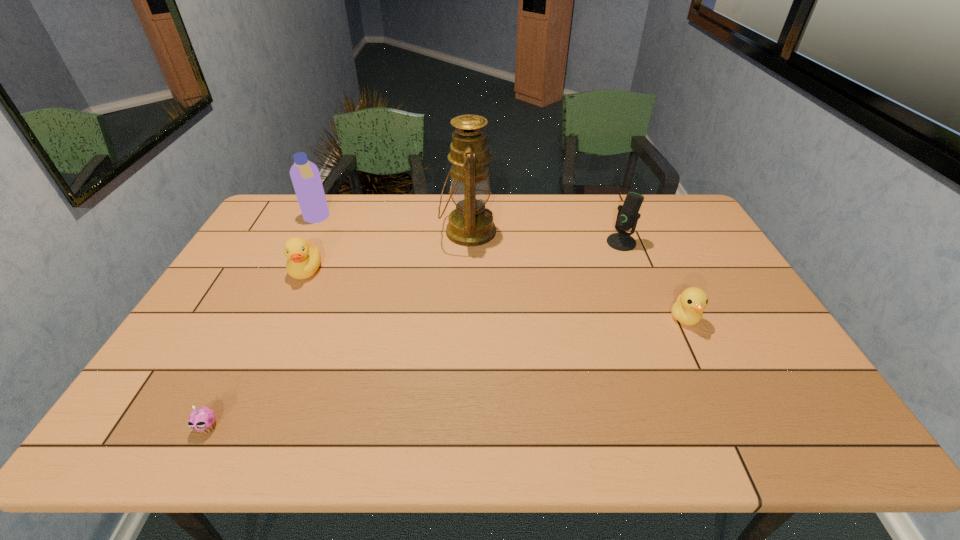
Locate an element on the screen. free space between the farther duck and the second object from right to left is located at coordinates tap(464, 256).

Where is `vacant point located between the right duck and the oil lamp`? vacant point located between the right duck and the oil lamp is located at coordinates (576, 275).

I want to click on vacant area that lies between the fifth object from left to right and the rightmost object, so click(x=653, y=280).

Identify the location of empty space between the nearest object and the farther duck. This screenshot has width=960, height=540. (257, 348).

Choose which object is the third nearest neighbor to the second object from right to left. Please provide its 2D coordinates. Your answer should be formatted as a tuple, i.e. [(x, y)], where the tuple contains the x and y coordinates of a point satisfying the conditions above.

[(304, 258)]

The image size is (960, 540). What are the coordinates of `object that stands as the fifth closest to the oil lamp` in the screenshot? It's located at (202, 419).

Identify the location of vacant space that satisfies the following two spatial constraints: 1. on the front side of the third object from right to left; 2. on the right side of the shampoo. The image size is (960, 540). (310, 232).

Locate an element on the screen. free space that satisfies the following two spatial constraints: 1. on the front side of the fifth object from left to right; 2. on the right side of the shampoo is located at coordinates (304, 242).